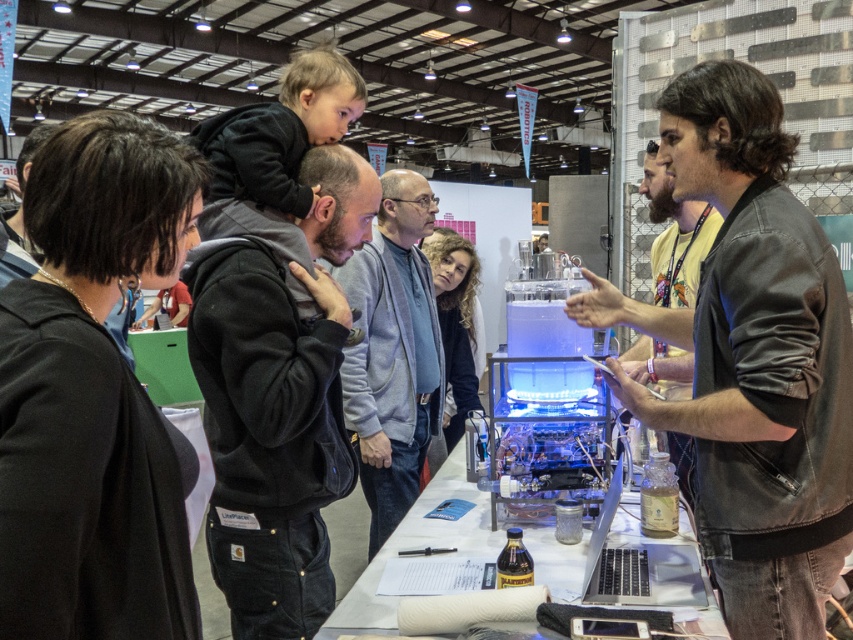
You are standing in the exhibition hall and see the black fleece jacket at center. If you want to reach it without moving your feet, can you do so?

The black fleece jacket at center is 5.56 feet from viewer. Since the average arm span is about 5.5 feet, you might be able to just barely reach it with your arm fully extended.

In the scene shown: You are at the exhibition and want to locate the denim jacket at center. According to the coordinates provided, where would you find it?

The denim jacket at center is located at coordinates point [757,360].